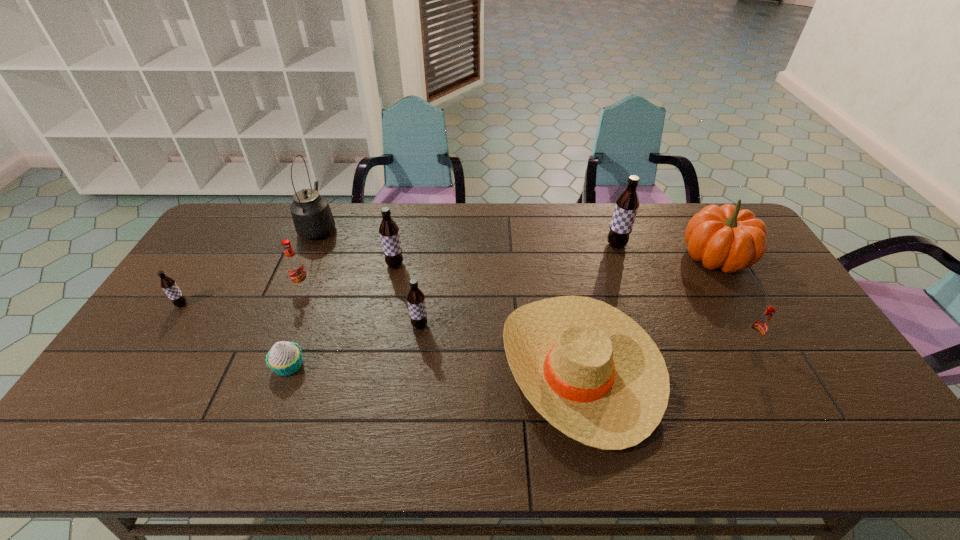
Locate an element on the screen. This screenshot has width=960, height=540. the closest brown root beer to the second biggest brown root beer is located at coordinates (416, 299).

Select which brown root beer appears as the second closest to the rightmost root beer. Please provide its 2D coordinates. Your answer should be formatted as a tuple, i.e. [(x, y)], where the tuple contains the x and y coordinates of a point satisfying the conditions above.

[(416, 299)]

I want to click on vacant region that satisfies the following two spatial constraints: 1. on the front side of the nearer red root beer; 2. on the right side of the third nearest root beer, so click(157, 341).

Where is `free space in the image that satisfies the following two spatial constraints: 1. on the back side of the fifth object from left to right; 2. on the left side of the third farthest root beer`? This screenshot has height=540, width=960. free space in the image that satisfies the following two spatial constraints: 1. on the back side of the fifth object from left to right; 2. on the left side of the third farthest root beer is located at coordinates (310, 265).

Locate an element on the screen. blank space that satisfies the following two spatial constraints: 1. on the front side of the third brown root beer from right to left; 2. on the right side of the third biggest brown root beer is located at coordinates (383, 326).